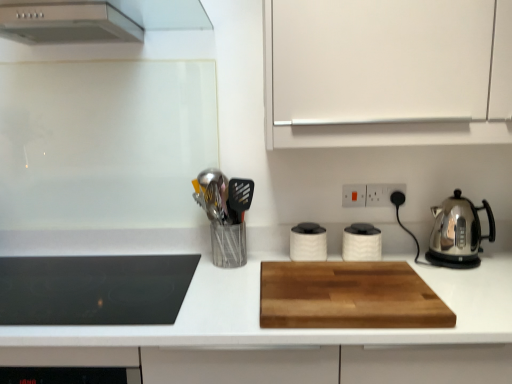
I want to click on white matte canister at center, the third kitchen appliance when ordered from left to right, so click(361, 243).

This screenshot has height=384, width=512. I want to click on black glass cooktop at left, which is the fourth kitchen appliance in right-to-left order, so click(94, 289).

In order to face white matte cabinet at upper right, should I rotate leftwards or rightwards?

To align with it, rotate right about 18.951°.

The width and height of the screenshot is (512, 384). In order to click on stainless steel kettle at right, the 4th kitchen appliance viewed from the left in this screenshot , I will do `click(458, 233)`.

Measure the distance between black plastic electric outlet at upper right, which is the first electric outlet from right to left, and camera.

The distance of black plastic electric outlet at upper right, which is the first electric outlet from right to left, from camera is 1.57 meters.

Where is `white matte canister at center, the third kitchen appliance when ordered from left to right`? white matte canister at center, the third kitchen appliance when ordered from left to right is located at coordinates (361, 243).

Based on the photo, are black plastic electric outlet at upper right, which is the 2th electric outlet from left to right, and white matte canister at center, which is counted as the second kitchen appliance, starting from the left, making contact?

black plastic electric outlet at upper right, which is the 2th electric outlet from left to right, is not next to white matte canister at center, which is counted as the second kitchen appliance, starting from the left, and they're not touching.

Consider the image. Considering the relative sizes of black plastic electric outlet at upper right, which is the 2th electric outlet from left to right, and white matte canister at center, which is counted as the second kitchen appliance, starting from the left, in the image provided, is black plastic electric outlet at upper right, which is the 2th electric outlet from left to right, smaller than white matte canister at center, which is counted as the second kitchen appliance, starting from the left,?

Indeed, black plastic electric outlet at upper right, which is the 2th electric outlet from left to right, has a smaller size compared to white matte canister at center, which is counted as the second kitchen appliance, starting from the left.

Based on their positions, is black plastic electric outlet at upper right, which is the 2th electric outlet from left to right, located to the left or right of white matte canister at center, which appears as the 3th kitchen appliance when viewed from the right?

From the image, it's evident that black plastic electric outlet at upper right, which is the 2th electric outlet from left to right, is to the right of white matte canister at center, which appears as the 3th kitchen appliance when viewed from the right.

In the image, is black plastic electric outlet at upper right, which is the first electric outlet from right to left, positioned in front of or behind white matte canister at center, which appears as the 3th kitchen appliance when viewed from the right?

In the image, black plastic electric outlet at upper right, which is the first electric outlet from right to left, appears behind white matte canister at center, which appears as the 3th kitchen appliance when viewed from the right.

Can you tell me how much black plastic electric outlet at upper right, which is the first electric outlet from right to left, and wooden cutting board at center differ in facing direction?

The angular difference between black plastic electric outlet at upper right, which is the first electric outlet from right to left, and wooden cutting board at center is 0.34 degrees.

From a real-world perspective, between black plastic electric outlet at upper right, which is the 2th electric outlet from left to right, and wooden cutting board at center, who is vertically lower?

wooden cutting board at center is physically lower.

From the image's perspective, which one is positioned lower, black plastic electric outlet at upper right, which is the first electric outlet from right to left, or wooden cutting board at center?

wooden cutting board at center, from the image's perspective.

Is there a large distance between black plastic electric outlet at upper right, which is the 2th electric outlet from left to right, and wooden cutting board at center?

No, black plastic electric outlet at upper right, which is the 2th electric outlet from left to right, is in close proximity to wooden cutting board at center.

Considering the relative sizes of stainless steel kettle at right, the first kitchen appliance positioned from the right, and black plastic electric outlet at upper right, which is the 2th electric outlet from left to right, in the image provided, is stainless steel kettle at right, the first kitchen appliance positioned from the right, thinner than black plastic electric outlet at upper right, which is the 2th electric outlet from left to right,?

In fact, stainless steel kettle at right, the first kitchen appliance positioned from the right, might be wider than black plastic electric outlet at upper right, which is the 2th electric outlet from left to right.

Is stainless steel kettle at right, the first kitchen appliance positioned from the right, taller or shorter than black plastic electric outlet at upper right, which is the 2th electric outlet from left to right?

Clearly, stainless steel kettle at right, the first kitchen appliance positioned from the right, is taller compared to black plastic electric outlet at upper right, which is the 2th electric outlet from left to right.

In the image, is stainless steel kettle at right, the 4th kitchen appliance viewed from the left, positioned in front of or behind black plastic electric outlet at upper right, which is the first electric outlet from right to left?

stainless steel kettle at right, the 4th kitchen appliance viewed from the left, is positioned closer to the viewer than black plastic electric outlet at upper right, which is the first electric outlet from right to left.

Considering the sizes of objects wooden cutting board at center and white matte canister at center, which ranks as the second kitchen appliance in right-to-left order, in the image provided, who is bigger, wooden cutting board at center or white matte canister at center, which ranks as the second kitchen appliance in right-to-left order,?

With larger size is wooden cutting board at center.

Is wooden cutting board at center in front of white matte canister at center, which ranks as the second kitchen appliance in right-to-left order?

That is True.

Visually, is wooden cutting board at center positioned to the left or to the right of white matte canister at center, the third kitchen appliance when ordered from left to right?

wooden cutting board at center is positioned on white matte canister at center, the third kitchen appliance when ordered from left to right,'s left side.

Does wooden cutting board at center have a greater width compared to white matte canister at center, which ranks as the second kitchen appliance in right-to-left order?

Indeed, wooden cutting board at center has a greater width compared to white matte canister at center, which ranks as the second kitchen appliance in right-to-left order.

Based on their sizes in the image, would you say white matte cabinet at upper right is bigger or smaller than stainless steel kettle at right, the 4th kitchen appliance viewed from the left?

In the image, white matte cabinet at upper right appears to be larger than stainless steel kettle at right, the 4th kitchen appliance viewed from the left.

From the image's perspective, is white matte cabinet at upper right over stainless steel kettle at right, the first kitchen appliance positioned from the right?

Indeed, from the image's perspective, white matte cabinet at upper right is shown above stainless steel kettle at right, the first kitchen appliance positioned from the right.

Can you confirm if white matte cabinet at upper right is shorter than stainless steel kettle at right, the 4th kitchen appliance viewed from the left?

No.

Relative to stainless steel kettle at right, the 4th kitchen appliance viewed from the left, is white matte cabinet at upper right in front or behind?

Clearly, white matte cabinet at upper right is in front of stainless steel kettle at right, the 4th kitchen appliance viewed from the left.

Find the location of `the 1st kitchen appliance counting from the left of the white matte canister at center, the third kitchen appliance when ordered from left to right`. the 1st kitchen appliance counting from the left of the white matte canister at center, the third kitchen appliance when ordered from left to right is located at coordinates (308, 242).

Is the surface of white matte canister at center, which ranks as the second kitchen appliance in right-to-left order, in direct contact with white matte canister at center, which appears as the 3th kitchen appliance when viewed from the right?

They are not placed beside each other.

From the image's perspective, which is below, white matte canister at center, which ranks as the second kitchen appliance in right-to-left order, or white matte canister at center, which is counted as the second kitchen appliance, starting from the left?

white matte canister at center, which ranks as the second kitchen appliance in right-to-left order, from the image's perspective.

From a real-world perspective, which is physically above, white matte canister at center, which ranks as the second kitchen appliance in right-to-left order, or white matte canister at center, which is counted as the second kitchen appliance, starting from the left?

From a 3D spatial view, white matte canister at center, which ranks as the second kitchen appliance in right-to-left order, is above.

Considering the sizes of objects black plastic electric outlet at upper right, which is the first electric outlet from right to left, and wooden cutting board at center in the image provided, who is thinner, black plastic electric outlet at upper right, which is the first electric outlet from right to left, or wooden cutting board at center?

With smaller width is black plastic electric outlet at upper right, which is the first electric outlet from right to left.

Does black plastic electric outlet at upper right, which is the first electric outlet from right to left, turn towards wooden cutting board at center?

No, black plastic electric outlet at upper right, which is the first electric outlet from right to left, is not aimed at wooden cutting board at center.

Considering the points (402, 184) and (272, 294), which point is in front, point (402, 184) or point (272, 294)?

The point (272, 294) is closer to the camera.

The height and width of the screenshot is (384, 512). What are the coordinates of `kitchen appliance that is the 2nd object to the left of the black plastic electric outlet at upper right, which is the 2th electric outlet from left to right, starting at the anchor` in the screenshot? It's located at (308, 242).

You are a GUI agent. You are given a task and a screenshot of the screen. Output one action in this format:
    pyautogui.click(x=<x>, y=<y>)
    Task: Click on the countertop below the black plastic electric outlet at upper right, which is the first electric outlet from right to left (from a real-world perspective)
    This screenshot has width=512, height=384.
    Given the screenshot: What is the action you would take?
    (281, 329)

Which object lies nearer to the anchor point white matte canister at center, the third kitchen appliance when ordered from left to right, wooden cutting board at center or black glass cooktop at left, the 1th kitchen appliance when ordered from left to right?

Among the two, wooden cutting board at center is located nearer to white matte canister at center, the third kitchen appliance when ordered from left to right.

Which object lies nearer to the anchor point wooden cutting board at center, white plastic electric outlet at upper center, which is the second electric outlet in right-to-left order, or black plastic electric outlet at upper right, which is the first electric outlet from right to left?

Based on the image, white plastic electric outlet at upper center, which is the second electric outlet in right-to-left order, appears to be nearer to wooden cutting board at center.

Based on their spatial positions, is wooden cutting board at center or white plastic electric outlet at upper center, positioned as the first electric outlet in left-to-right order, further from black plastic electric outlet at upper right, which is the first electric outlet from right to left?

Among the two, wooden cutting board at center is located further to black plastic electric outlet at upper right, which is the first electric outlet from right to left.

Looking at the image, which one is located closer to metallic silver utensil holder at center-left, white matte canister at center, the third kitchen appliance when ordered from left to right, or wooden cutting board at center?

The object closer to metallic silver utensil holder at center-left is wooden cutting board at center.

Based on their spatial positions, is white matte cabinet at upper right or white plastic electric outlet at upper center, which is the second electric outlet in right-to-left order, closer to white matte canister at center, the third kitchen appliance when ordered from left to right?

Based on the image, white plastic electric outlet at upper center, which is the second electric outlet in right-to-left order, appears to be nearer to white matte canister at center, the third kitchen appliance when ordered from left to right.

Based on their spatial positions, is black glass cooktop at left, the 1th kitchen appliance when ordered from left to right, or wooden cutting board at center further from white plastic electric outlet at upper center, positioned as the first electric outlet in left-to-right order?

The object further to white plastic electric outlet at upper center, positioned as the first electric outlet in left-to-right order, is black glass cooktop at left, the 1th kitchen appliance when ordered from left to right.

Looking at the image, which one is located further to black plastic electric outlet at upper right, which is the first electric outlet from right to left, metallic silver utensil holder at center-left or white matte canister at center, which ranks as the second kitchen appliance in right-to-left order?

metallic silver utensil holder at center-left is further to black plastic electric outlet at upper right, which is the first electric outlet from right to left.

Considering their positions, is white matte cabinet at upper right positioned further to black plastic electric outlet at upper right, which is the 2th electric outlet from left to right, than white plastic electric outlet at upper center, which is the second electric outlet in right-to-left order?

white matte cabinet at upper right is positioned further to the anchor black plastic electric outlet at upper right, which is the 2th electric outlet from left to right.

This screenshot has height=384, width=512. I want to click on kitchen appliance situated between white matte canister at center, which appears as the 3th kitchen appliance when viewed from the right, and stainless steel kettle at right, the first kitchen appliance positioned from the right, from left to right, so click(x=361, y=243).

Where is `appliance between wooden cutting board at center and wooden cutting board at center in the horizontal direction`? The image size is (512, 384). appliance between wooden cutting board at center and wooden cutting board at center in the horizontal direction is located at coordinates (225, 214).

The width and height of the screenshot is (512, 384). In order to click on cutting board located between black glass cooktop at left, the 1th kitchen appliance when ordered from left to right, and white matte cabinet at upper right in the left-right direction in this screenshot , I will do `click(348, 296)`.

At what (x,y) coordinates should I click in order to perform the action: click on kitchen appliance between black glass cooktop at left, which is the fourth kitchen appliance in right-to-left order, and wooden cutting board at center. Please return your answer as a coordinate pair (x, y). This screenshot has height=384, width=512. Looking at the image, I should click on (308, 242).